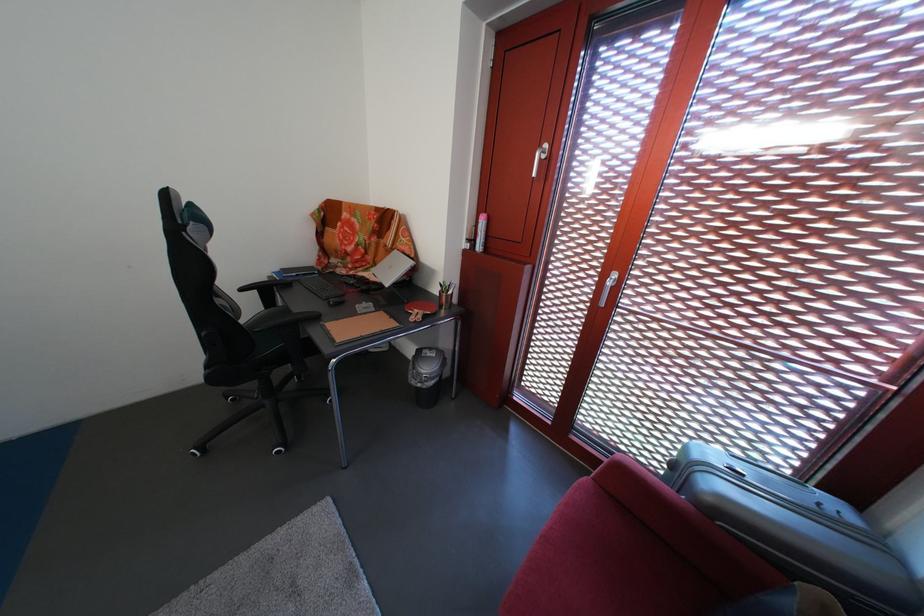
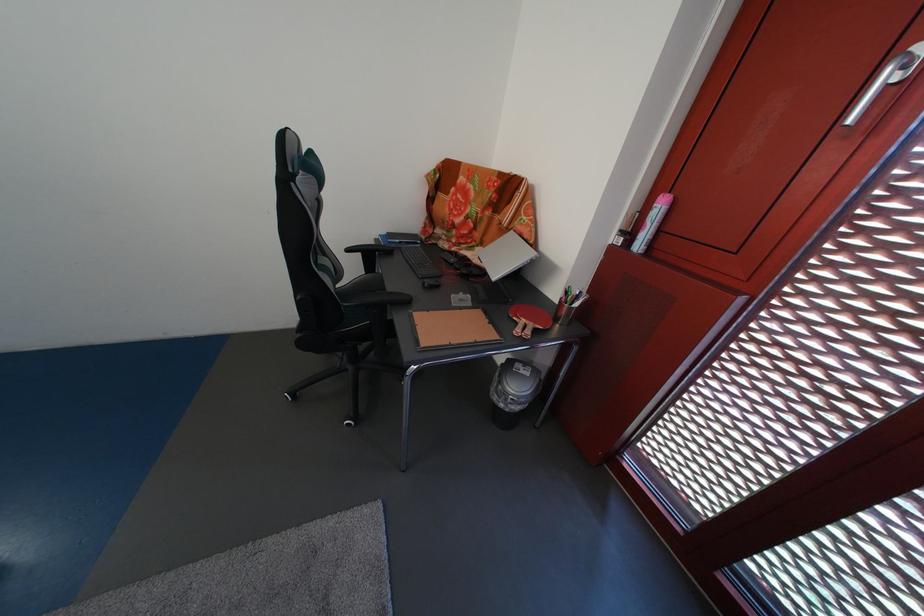
Which direction would the cameraman need to move to produce the second image?

The movement direction of the cameraman is left, forward.